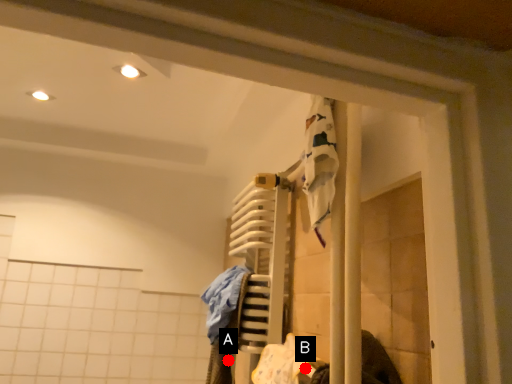
Question: Two points are circled on the image, labeled by A and B beside each circle. Among these points, which one is nearest to the camera?

Choices:
 (A) A is closer
 (B) B is closer

Answer: (B)